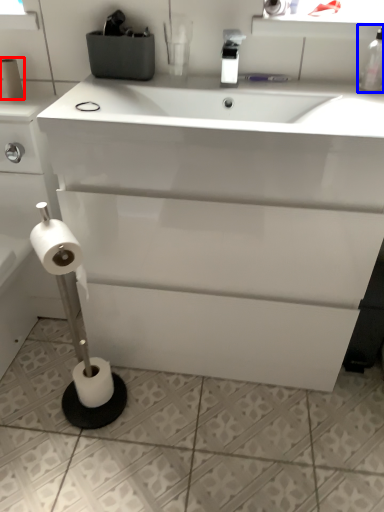
Question: Which object appears closest to the camera in this image, toilet paper (highlighted by a red box) or bottle (highlighted by a blue box)?

Choices:
 (A) toilet paper
 (B) bottle

Answer: (B)